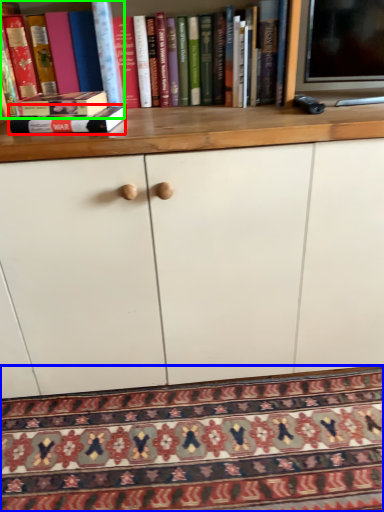
Question: Estimate the real-world distances between objects in this image. Which object is closer to book (highlighted by a red box), mat (highlighted by a blue box) or book (highlighted by a green box)?

Choices:
 (A) mat
 (B) book

Answer: (B)